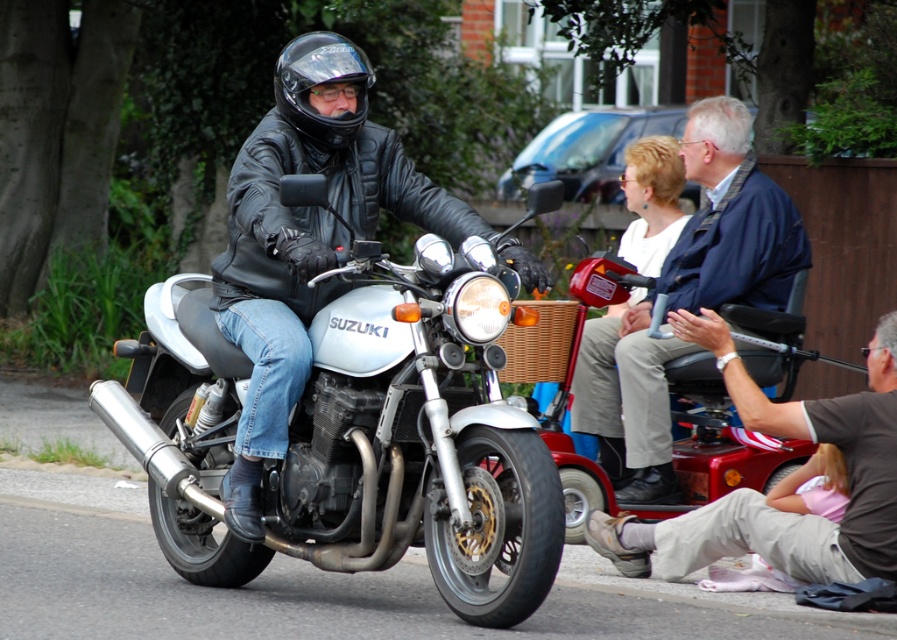
Question: Which is nearer to the brown leather jacket at lower right?

Choices:
 (A) silver metallic motorcycle at center
 (B) matte black motorcycle at center
 (C) blue denim jacket at upper center
 (D) black matte helmet at center

Answer: (C)

Question: Which point appears closest to the camera in this image?

Choices:
 (A) 504,253
 (B) 643,573
 (C) 323,56
 (D) 689,346

Answer: (A)

Question: Among these objects, which one is nearest to the camera?

Choices:
 (A) matte black motorcycle at center
 (B) blue denim jacket at upper center

Answer: (A)

Question: From the image, what is the correct spatial relationship of matte black motorcycle at center in relation to blue denim jacket at upper center?

Choices:
 (A) right
 (B) left

Answer: (B)

Question: Is silver metallic motorcycle at center to the right of blue denim jacket at upper center from the viewer's perspective?

Choices:
 (A) yes
 (B) no

Answer: (B)

Question: Can you confirm if matte black motorcycle at center is positioned to the left of black matte helmet at center?

Choices:
 (A) yes
 (B) no

Answer: (A)